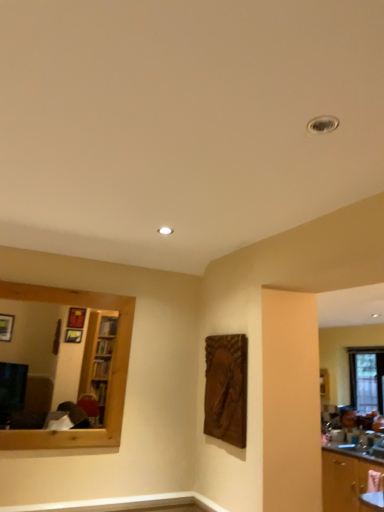
Question: Is clear glass window at right taller or shorter than wooden mirror at left?

Choices:
 (A) tall
 (B) short

Answer: (A)

Question: From a real-world perspective, relative to wooden mirror at left, is clear glass window at right vertically above or below?

Choices:
 (A) below
 (B) above

Answer: (A)

Question: Estimate the real-world distances between objects in this image. Which object is closer to the wooden mirror at left?

Choices:
 (A) clear glass window at right
 (B) wooden cabinet at lower right

Answer: (B)

Question: Based on their relative distances, which object is nearer to the clear glass window at right?

Choices:
 (A) wooden cabinet at lower right
 (B) wooden mirror at left

Answer: (A)